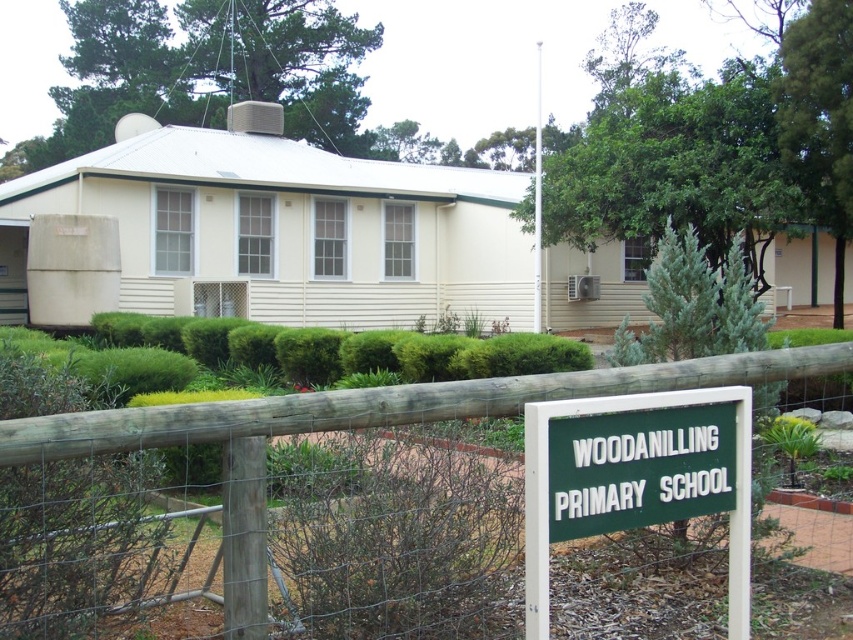
Which is more to the left, wooden fence at center or green plastic sign at center?

wooden fence at center

What are the coordinates of `wooden fence at center` in the screenshot? It's located at (361, 428).

In order to click on wooden fence at center in this screenshot , I will do `click(361, 428)`.